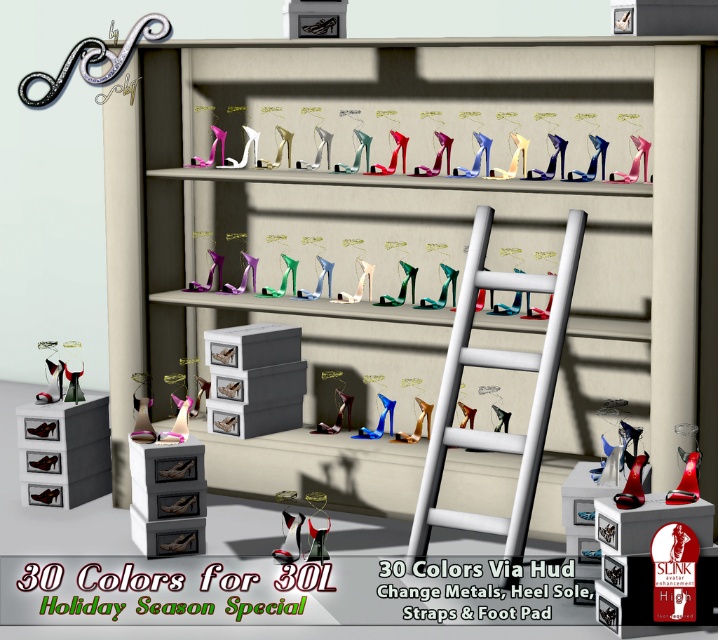
Consider the image. Can you confirm if metallic silver bookshelf at upper center is bigger than white ladder at center?

Yes.

Is metallic silver bookshelf at upper center smaller than white ladder at center?

Incorrect, metallic silver bookshelf at upper center is not smaller in size than white ladder at center.

This screenshot has width=718, height=640. Identify the location of metallic silver bookshelf at upper center. (424, 220).

Which is in front, point (536, 276) or point (190, 403)?

Point (536, 276) is in front.

Who is higher up, white ladder at center or pink satin high heel at center?

Positioned higher is white ladder at center.

Find the location of a particular element. The width and height of the screenshot is (718, 640). white ladder at center is located at coordinates (495, 368).

Between pink satin high heel at center and matte black high-heeled shoe at center, which one has less height?

With less height is pink satin high heel at center.

What are the coordinates of `pink satin high heel at center` in the screenshot? It's located at (177, 422).

This screenshot has height=640, width=718. I want to click on pink satin high heel at center, so click(177, 422).